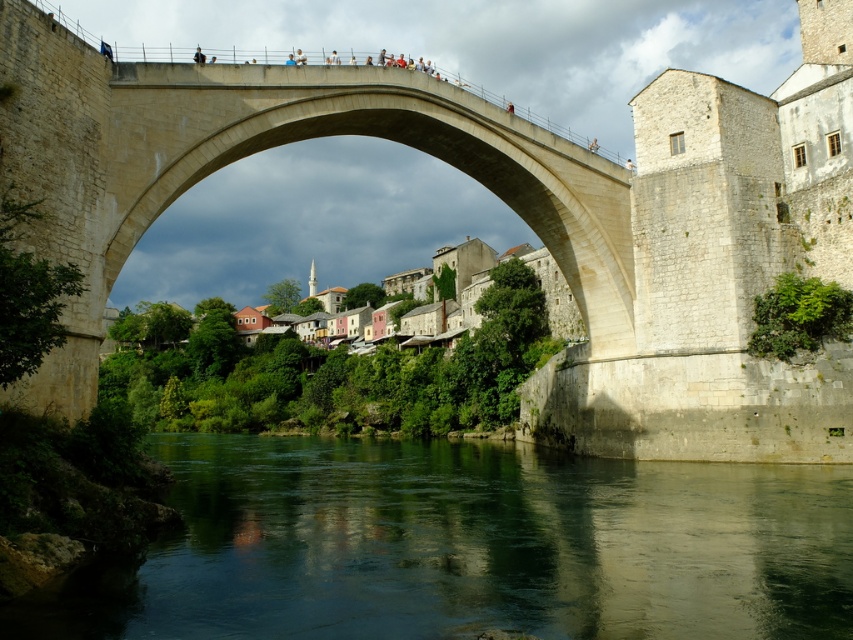
You are a tourist standing on the riverbank and want to take a photo of the beige stone bridge at center and the green smooth water at lower center. Based on their sizes in the image, which one would appear wider in your photo?

The green smooth water at lower center would appear wider in the photo because its width is larger than that of the beige stone bridge at center.

structural engineer is standing at the camera position and wants to inspect the point at coordinates (224, 483) on the historic stone bridge. The engineer has a drone that can fly up to 60 meters. Can the drone reach the point?

The point at coordinates (224, 483) is 63.84 meters away from the camera. Since the drone can only fly up to 60 meters, it cannot reach the point.